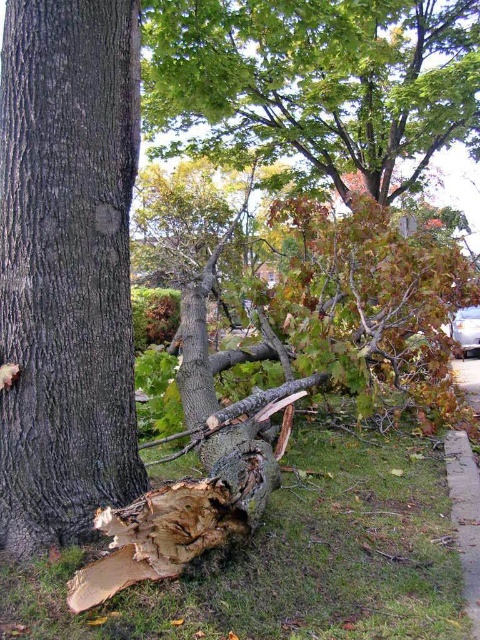
Who is lower down, dark brown rough bark at center or green leafy tree at center?

Positioned lower is dark brown rough bark at center.

Can you confirm if dark brown rough bark at center is shorter than green leafy tree at center?

Indeed, dark brown rough bark at center has a lesser height compared to green leafy tree at center.

Is point (84, 260) behind point (235, 138)?

No, it is not.

You are a GUI agent. You are given a task and a screenshot of the screen. Output one action in this format:
    pyautogui.click(x=<x>, y=<y>)
    Task: Click on the dark brown rough bark at center
    
    Given the screenshot: What is the action you would take?
    pyautogui.click(x=67, y=266)